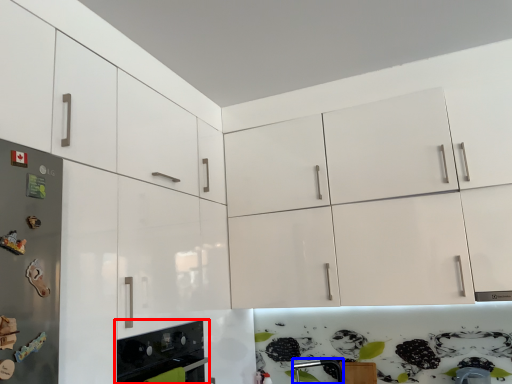
Question: Which point is further to the camera, home appliance (highlighted by a red box) or silver (highlighted by a blue box)?

Choices:
 (A) home appliance
 (B) silver

Answer: (B)